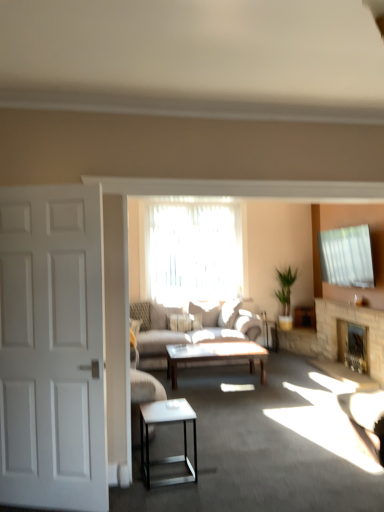
Question: In the image, is translucent fabric at center positioned in front of or behind stone fireplace at center, marked as the first fireplace in a back-to-front arrangement?

Choices:
 (A) behind
 (B) front

Answer: (A)

Question: From the image's perspective, is translucent fabric at center located above or below stone fireplace at center, the second fireplace in the front-to-back sequence?

Choices:
 (A) above
 (B) below

Answer: (A)

Question: Which of these objects is positioned closest to the white matte door at left?

Choices:
 (A) light gray fabric couch at center
 (B) translucent fabric at center
 (C) green leafy plant at center-right
 (D) white glossy side table at lower center
 (E) stone fireplace at center, the second fireplace in the front-to-back sequence

Answer: (D)

Question: Which object is the closest to the white glossy side table at lower center?

Choices:
 (A) green leafy plant at center-right
 (B) wooden polished coffee table at center
 (C) translucent fabric at center
 (D) stone fireplace at center, the first fireplace from the front
 (E) stone fireplace at center, marked as the first fireplace in a back-to-front arrangement

Answer: (B)